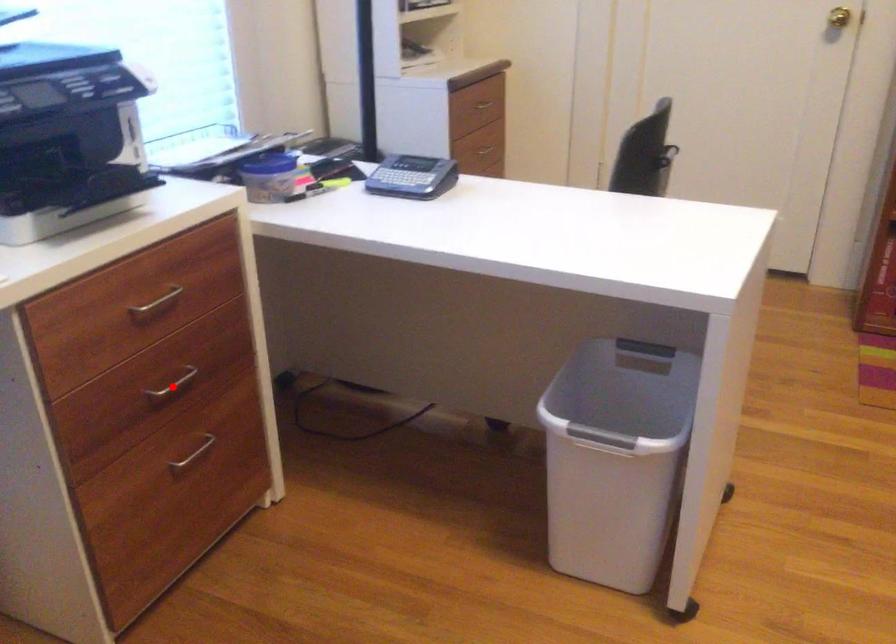
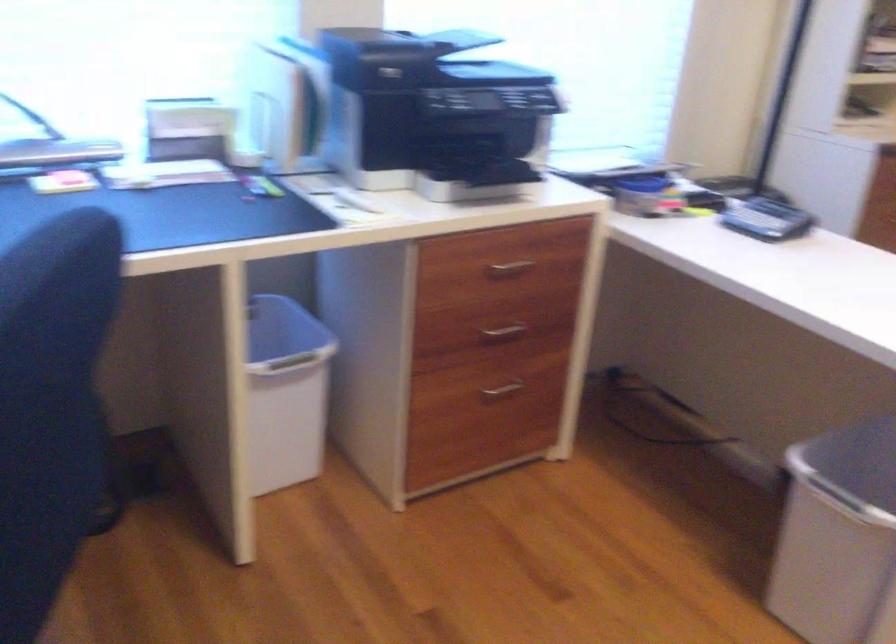
Question: I am providing you with two images of the same scene from different viewpoints. Given a red point in image1, look at the same physical point in image2. Is it:

Choices:
 (A) Closer to the viewpoint
 (B) Farther from the viewpoint

Answer: (B)